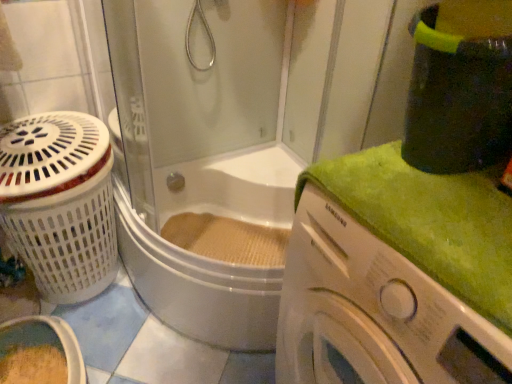
Question: Does white glossy washing machine at right come behind white plastic laundry basket at left?

Choices:
 (A) no
 (B) yes

Answer: (A)

Question: From a real-world perspective, is white glossy washing machine at right under white plastic laundry basket at left?

Choices:
 (A) no
 (B) yes

Answer: (A)

Question: Can you confirm if white glossy washing machine at right is thinner than white plastic laundry basket at left?

Choices:
 (A) yes
 (B) no

Answer: (B)

Question: Does white glossy washing machine at right come in front of white plastic laundry basket at left?

Choices:
 (A) no
 (B) yes

Answer: (B)

Question: Is white glossy washing machine at right next to white plastic laundry basket at left and touching it?

Choices:
 (A) yes
 (B) no

Answer: (B)

Question: Is transparent glass shower door at upper center situated inside white plastic laundry basket at left or outside?

Choices:
 (A) outside
 (B) inside

Answer: (A)

Question: Considering their positions, is transparent glass shower door at upper center located in front of or behind white plastic laundry basket at left?

Choices:
 (A) behind
 (B) front

Answer: (B)

Question: Considering the positions of transparent glass shower door at upper center and white plastic laundry basket at left in the image, is transparent glass shower door at upper center bigger or smaller than white plastic laundry basket at left?

Choices:
 (A) small
 (B) big

Answer: (B)

Question: From the image's perspective, relative to white plastic laundry basket at left, is transparent glass shower door at upper center above or below?

Choices:
 (A) above
 (B) below

Answer: (A)

Question: Would you say white glossy washing machine at right is to the left or to the right of transparent glass shower door at upper center in the picture?

Choices:
 (A) right
 (B) left

Answer: (A)

Question: Which is correct: white glossy washing machine at right is inside transparent glass shower door at upper center, or outside of it?

Choices:
 (A) outside
 (B) inside

Answer: (A)

Question: Considering the positions of white glossy washing machine at right and transparent glass shower door at upper center in the image, is white glossy washing machine at right bigger or smaller than transparent glass shower door at upper center?

Choices:
 (A) big
 (B) small

Answer: (B)

Question: In terms of height, does white glossy washing machine at right look taller or shorter compared to transparent glass shower door at upper center?

Choices:
 (A) tall
 (B) short

Answer: (B)

Question: Considering the positions of white plastic laundry basket at left and transparent glass shower door at upper center in the image, is white plastic laundry basket at left taller or shorter than transparent glass shower door at upper center?

Choices:
 (A) short
 (B) tall

Answer: (A)

Question: Considering their positions, is white plastic laundry basket at left located in front of or behind transparent glass shower door at upper center?

Choices:
 (A) front
 (B) behind

Answer: (B)